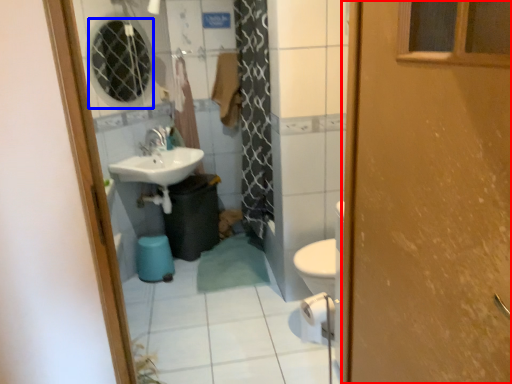
Question: Among these objects, which one is farthest to the camera, door (highlighted by a red box) or mirror (highlighted by a blue box)?

Choices:
 (A) door
 (B) mirror

Answer: (B)